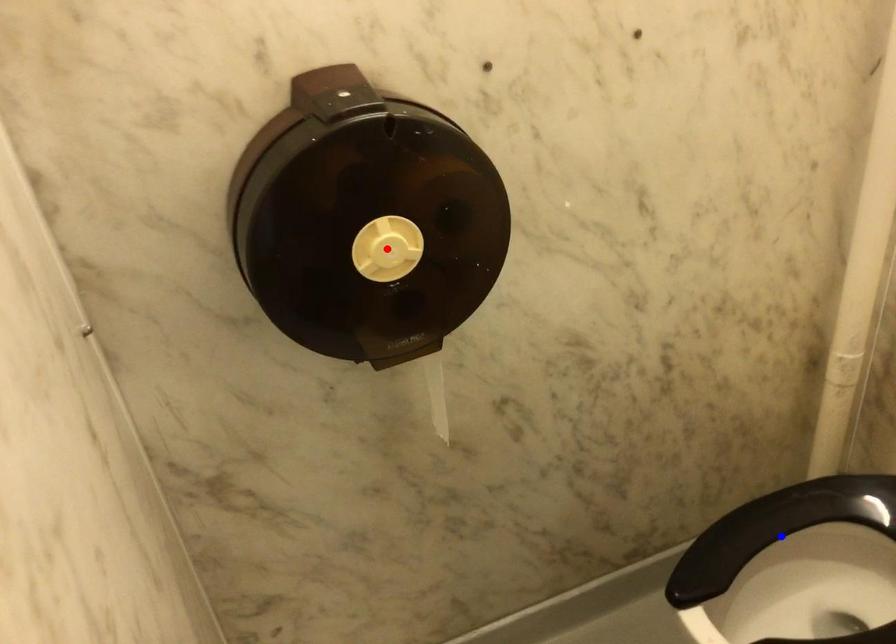
Question: Two points are marked on the image. Which point is closer to the camera?

Choices:
 (A) Blue point is closer.
 (B) Red point is closer.

Answer: (B)